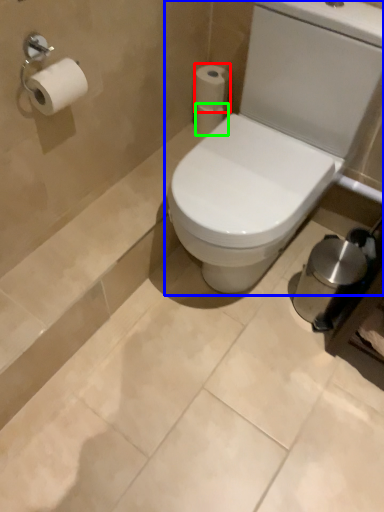
Question: Which is nearer to the toilet paper (highlighted by a red box)? toilet (highlighted by a blue box) or toilet paper (highlighted by a green box).

Choices:
 (A) toilet
 (B) toilet paper

Answer: (B)